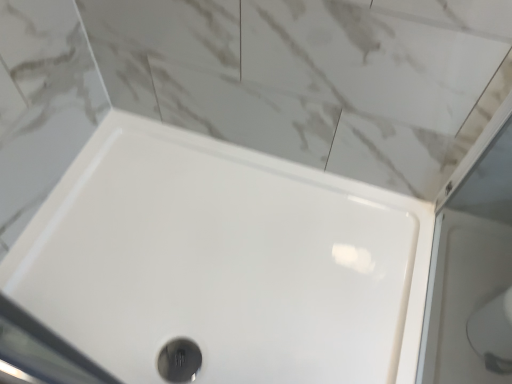
What do you see at coordinates (224, 262) in the screenshot?
I see `white glossy bathtub at center` at bounding box center [224, 262].

What are the coordinates of `white glossy bathtub at center` in the screenshot? It's located at (224, 262).

Where is `white glossy bathtub at center`? white glossy bathtub at center is located at coordinates (224, 262).